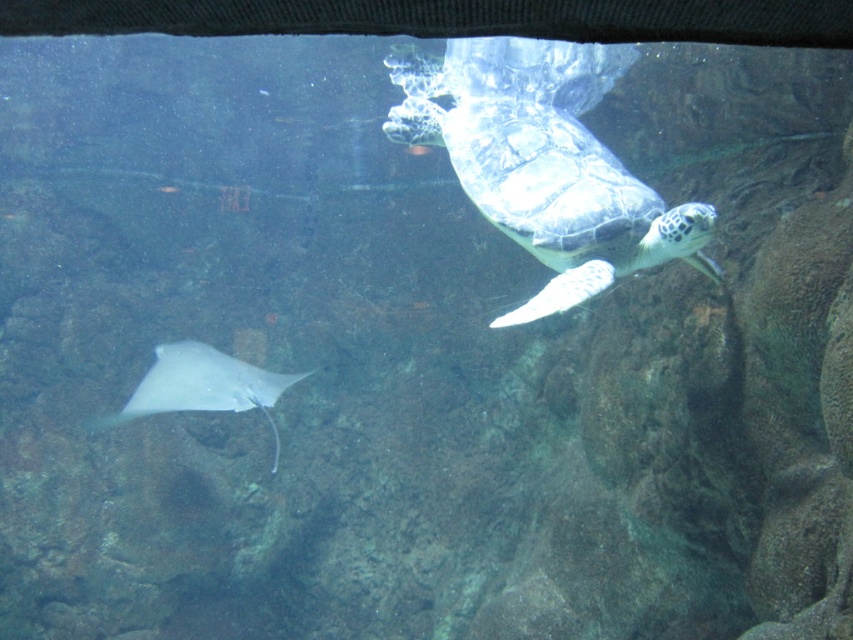
Is smooth green turtle at upper center shorter than white glossy stingray at lower left?

Incorrect, smooth green turtle at upper center's height does not fall short of white glossy stingray at lower left's.

Which is more to the right, smooth green turtle at upper center or white glossy stingray at lower left?

smooth green turtle at upper center

The height and width of the screenshot is (640, 853). Identify the location of smooth green turtle at upper center. (546, 161).

Image resolution: width=853 pixels, height=640 pixels. Identify the location of smooth green turtle at upper center. (546, 161).